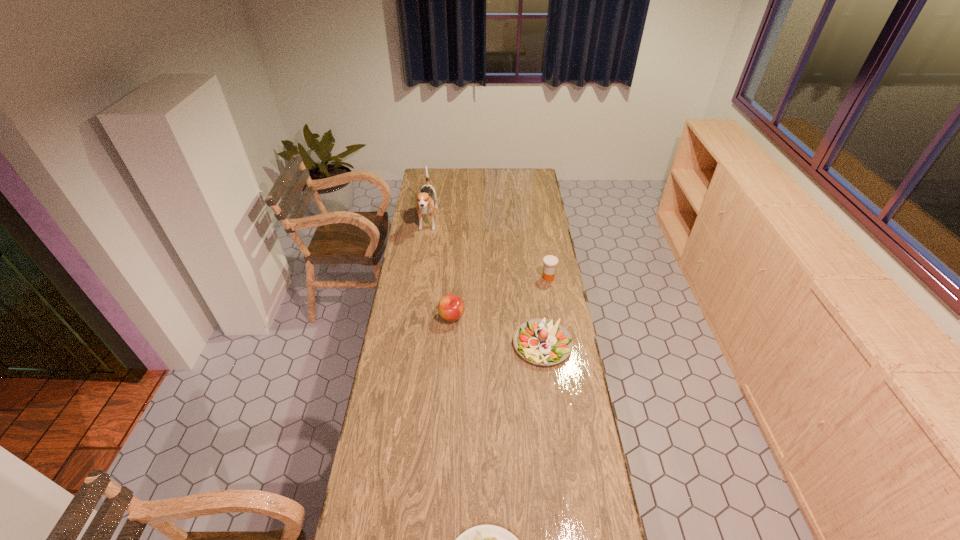
Identify the location of vacant area between the fourth tallest object and the apple. The image size is (960, 540). (497, 330).

You are a GUI agent. You are given a task and a screenshot of the screen. Output one action in this format:
    pyautogui.click(x=<x>, y=<y>)
    Task: Click on the vacant space in between the apple and the farther salad plate
    The width and height of the screenshot is (960, 540).
    Given the screenshot: What is the action you would take?
    pyautogui.click(x=497, y=330)

Find the location of a particular element. This screenshot has width=960, height=540. blank region between the leftmost object and the farther salad plate is located at coordinates (485, 282).

Locate an element on the screen. The width and height of the screenshot is (960, 540). vacant space that's between the second farthest object and the taller salad plate is located at coordinates (545, 310).

Where is `vacant space in between the second shortest object and the tallest object`? The height and width of the screenshot is (540, 960). vacant space in between the second shortest object and the tallest object is located at coordinates (485, 282).

Where is `vacant point located between the second shortest object and the apple`? This screenshot has width=960, height=540. vacant point located between the second shortest object and the apple is located at coordinates (497, 330).

I want to click on vacant region between the tallest object and the apple, so click(440, 269).

The image size is (960, 540). What are the coordinates of `object identified as the closest to the apple` in the screenshot? It's located at (541, 341).

Identify which object is the closest to the shorter salad plate. Please provide its 2D coordinates. Your answer should be formatted as a tuple, i.e. [(x, y)], where the tuple contains the x and y coordinates of a point satisfying the conditions above.

[(541, 341)]

The height and width of the screenshot is (540, 960). Identify the location of vacant point that satisfies the following two spatial constraints: 1. at the face of the fourth tallest object; 2. on the right side of the leftmost object. pyautogui.click(x=410, y=344).